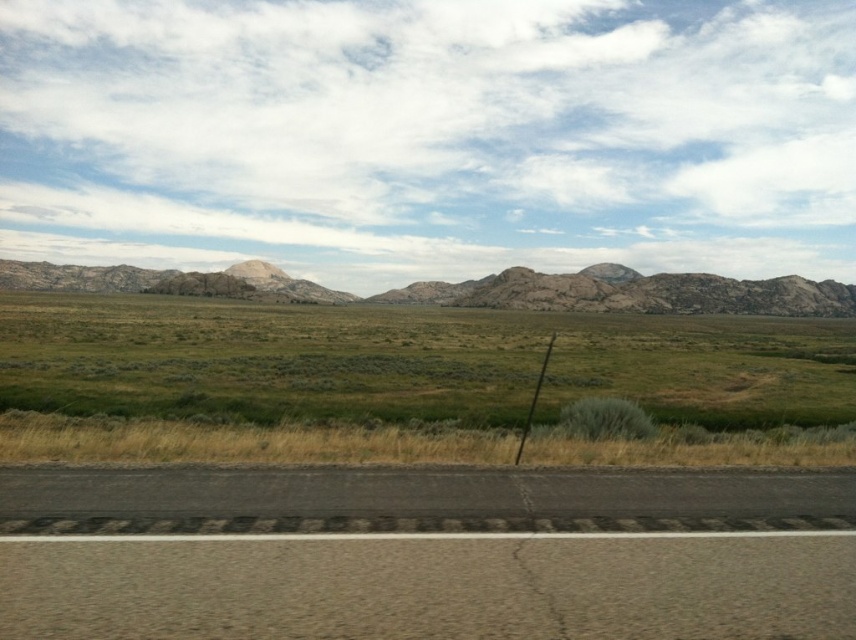
Which is more to the left, black asphalt road at lower center or green grassland at center?

Positioned to the left is black asphalt road at lower center.

You are a GUI agent. You are given a task and a screenshot of the screen. Output one action in this format:
    pyautogui.click(x=<x>, y=<y>)
    Task: Click on the black asphalt road at lower center
    
    Given the screenshot: What is the action you would take?
    pyautogui.click(x=425, y=554)

Can you confirm if green grassland at center is positioned below rugged stone mountain range at center?

Yes.

Does green grassland at center appear on the left side of rugged stone mountain range at center?

In fact, green grassland at center is to the right of rugged stone mountain range at center.

The width and height of the screenshot is (856, 640). What do you see at coordinates (407, 384) in the screenshot?
I see `green grassland at center` at bounding box center [407, 384].

Locate an element on the screen. This screenshot has width=856, height=640. green grassland at center is located at coordinates (407, 384).

Between black asphalt road at lower center and rugged stone mountain range at center, which one has less height?

With less height is black asphalt road at lower center.

You are a GUI agent. You are given a task and a screenshot of the screen. Output one action in this format:
    pyautogui.click(x=<x>, y=<y>)
    Task: Click on the black asphalt road at lower center
    The image size is (856, 640).
    Given the screenshot: What is the action you would take?
    (x=425, y=554)

Who is more distant from viewer, (776, 508) or (165, 272)?

Point (165, 272)

Locate an element on the screen. Image resolution: width=856 pixels, height=640 pixels. black asphalt road at lower center is located at coordinates (425, 554).